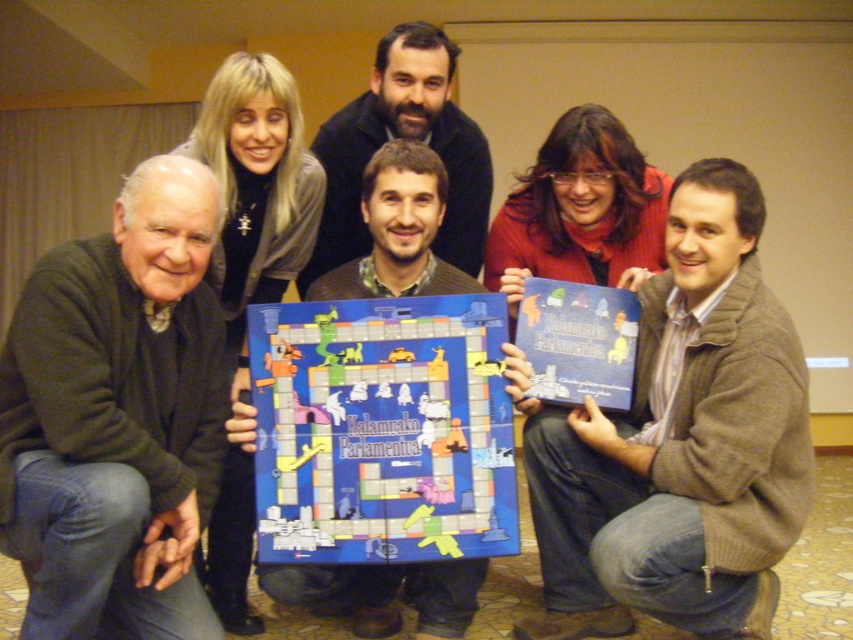
You are organizing a photo shoot and need to arrange the brown sweater at center and the dark green sweater at lower left in a way that maintains their original height relationship. If you want to place both sweaters on a shelf, which sweater should be placed on the higher shelf to ensure the taller one is visually dominant?

The brown sweater at center is much taller than the dark green sweater at lower left, so to maintain their height relationship and ensure visual dominance, the brown sweater at center should be placed on the higher shelf.

You are organizing a photo shoot for a board game and need to ensure that the dark green sweater at lower left and the bearded man at center are visible in the frame. Based on the scene description, which object should be placed closer to the camera to ensure both are fully visible?

The dark green sweater at lower left is taller than the bearded man at center, so to ensure both are fully visible in the frame, the bearded man at center should be placed closer to the camera.

You are at a social gathering where people are presenting a board game. You see a brown sweater at center and a dark green sweater at lower left. Which person is positioned to the right of the other?

The brown sweater at center is to the right of the dark green sweater at lower left.